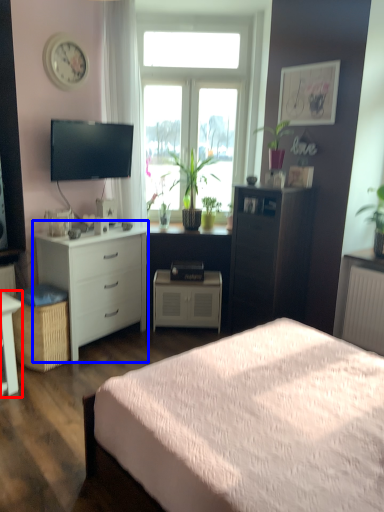
Question: Which point is closer to the camera, desk (highlighted by a red box) or chest of drawers (highlighted by a blue box)?

Choices:
 (A) desk
 (B) chest of drawers

Answer: (A)